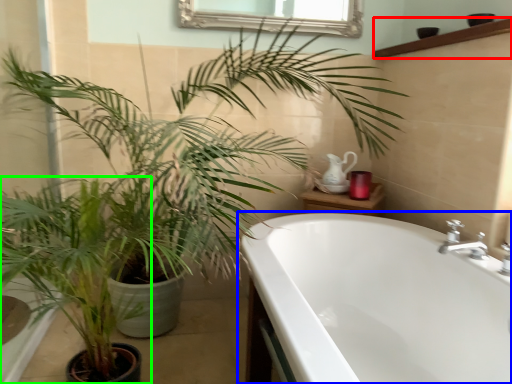
Question: Which object is positioned farthest from balustrade (highlighted by a red box)? Select from bathtub (highlighted by a blue box) and houseplant (highlighted by a green box).

Choices:
 (A) bathtub
 (B) houseplant

Answer: (B)